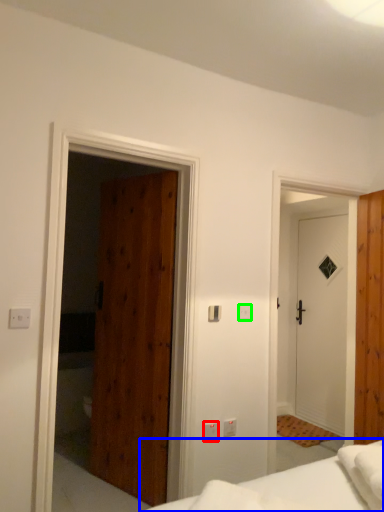
Question: Considering the real-world distances, which object is farthest from light switch (highlighted by a red box)? bed (highlighted by a blue box) or light switch (highlighted by a green box)?

Choices:
 (A) bed
 (B) light switch

Answer: (A)